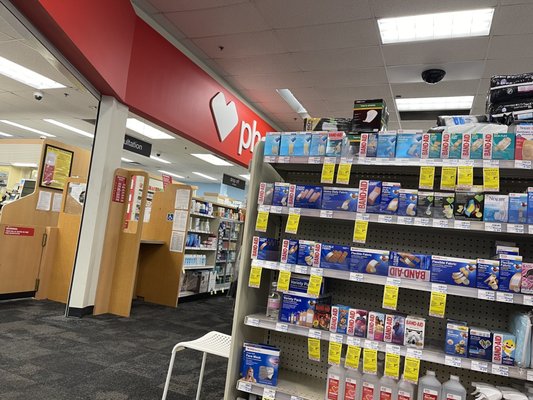
Locate an element on the screen. The image size is (533, 400). brown wall partition is located at coordinates (12, 219).